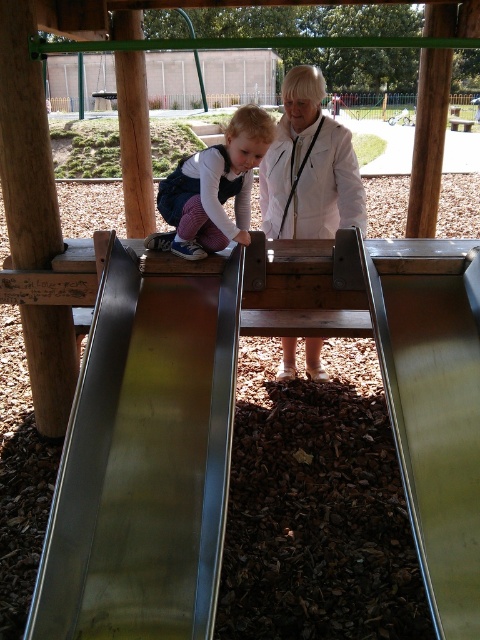
Question: Can you confirm if metallic smooth slide at upper left is smaller than white matte jacket at center?

Choices:
 (A) no
 (B) yes

Answer: (A)

Question: Can you confirm if metallic smooth slide at upper left is positioned to the left of matte purple pants at center?

Choices:
 (A) no
 (B) yes

Answer: (B)

Question: Which object is closer to the camera taking this photo?

Choices:
 (A) white matte jacket at center
 (B) metallic smooth slide at upper left

Answer: (B)

Question: Which of these objects is positioned closest to the white matte jacket at center?

Choices:
 (A) metallic smooth slide at upper left
 (B) matte purple pants at center

Answer: (B)

Question: Can you confirm if metallic smooth slide at upper left is positioned to the right of white matte jacket at center?

Choices:
 (A) no
 (B) yes

Answer: (A)

Question: Which object is positioned closest to the matte purple pants at center?

Choices:
 (A) metallic smooth slide at upper left
 (B) white matte jacket at center

Answer: (B)